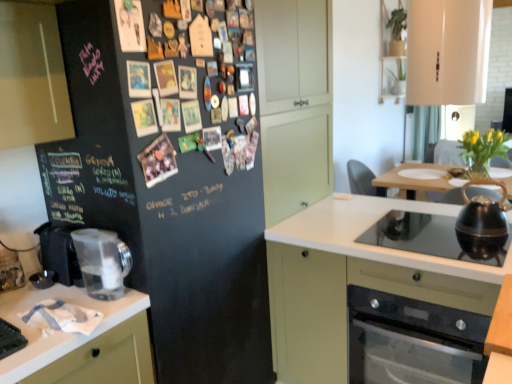
Question: In terms of size, does black glass stove at lower right appear bigger or smaller than wooden table at lower right?

Choices:
 (A) small
 (B) big

Answer: (B)

Question: From a real-world perspective, is black glass stove at lower right positioned above or below wooden table at lower right?

Choices:
 (A) below
 (B) above

Answer: (A)

Question: Estimate the real-world distances between objects in this image. Which object is farther from the wooden table at lower right?

Choices:
 (A) black glass stove at lower right
 (B) black matte refrigerator at left
 (C) white glossy cabinet at upper right, positioned as the 1th cabinetry in top-to-bottom order
 (D) black plastic coffee maker at left
 (E) black glass cooktop at lower right

Answer: (D)

Question: Considering the real-world distances, which object is closest to the black glass stove at lower right?

Choices:
 (A) transparent plastic pitcher at left, the first kitchen appliance from the left
 (B) wooden table at lower right
 (C) shiny black kettle at right, which ranks as the second kitchen appliance in left-to-right order
 (D) black plastic coffee maker at left
 (E) matte white cabinet at center, which is counted as the first cabinetry, starting from the bottom

Answer: (E)